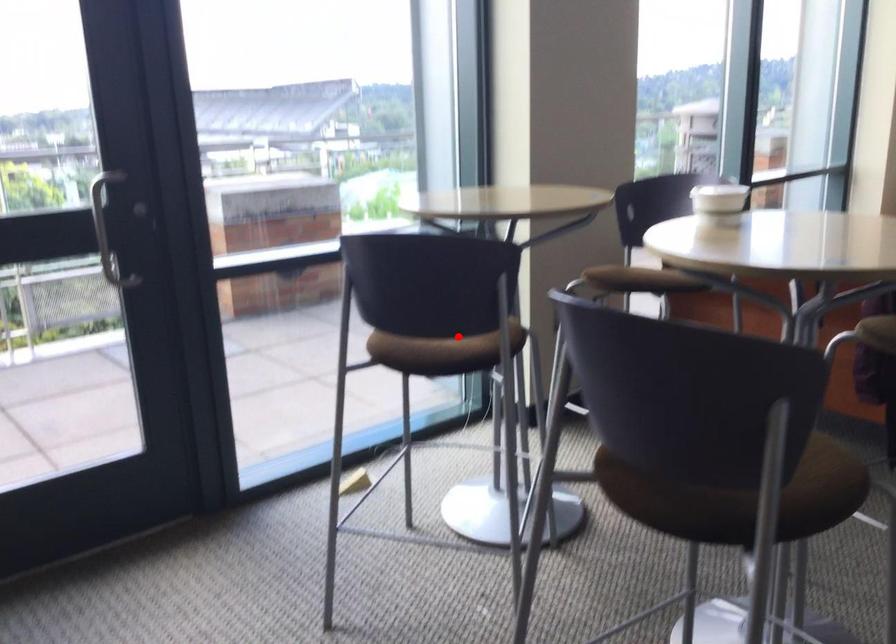
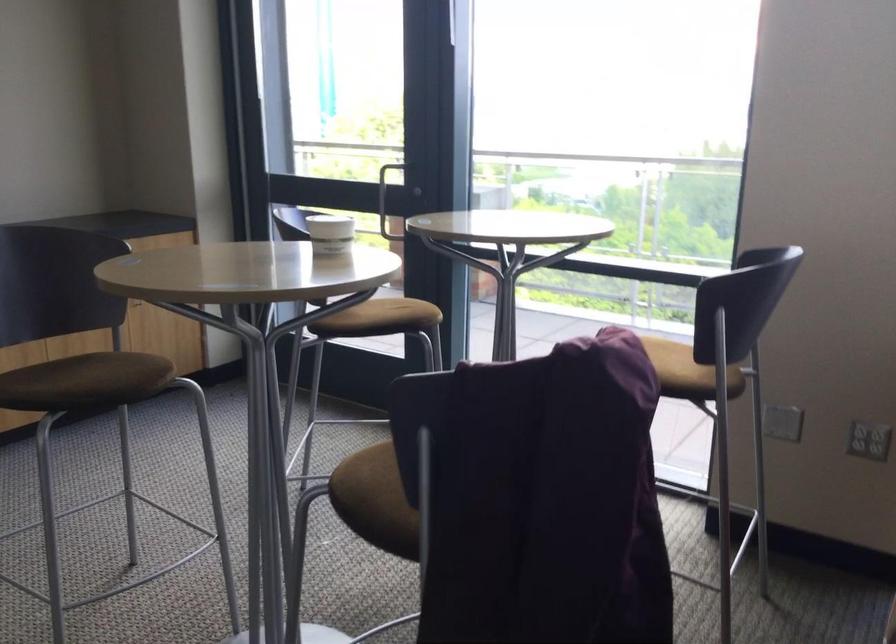
In the second image, find the point that corresponds to the highlighted location in the first image.

(401, 314)